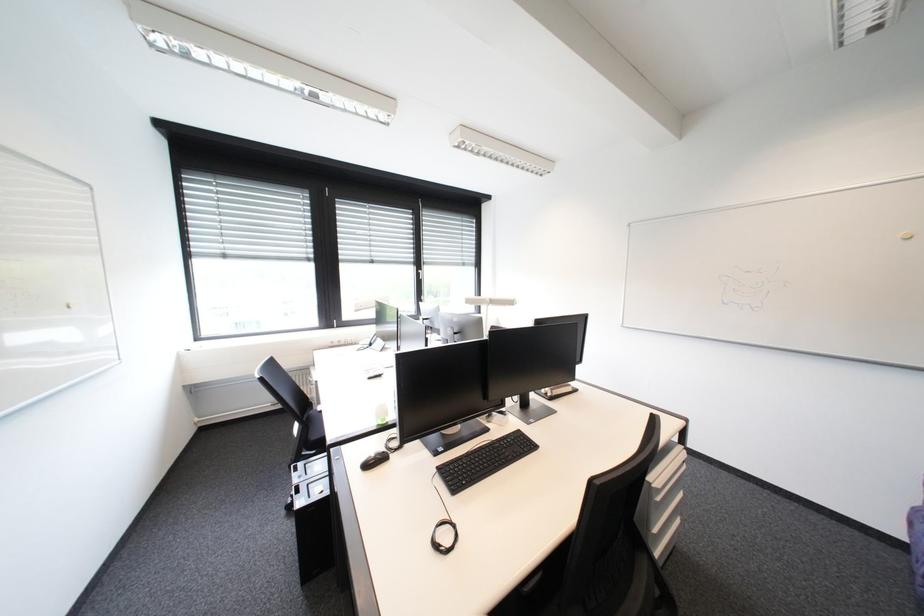
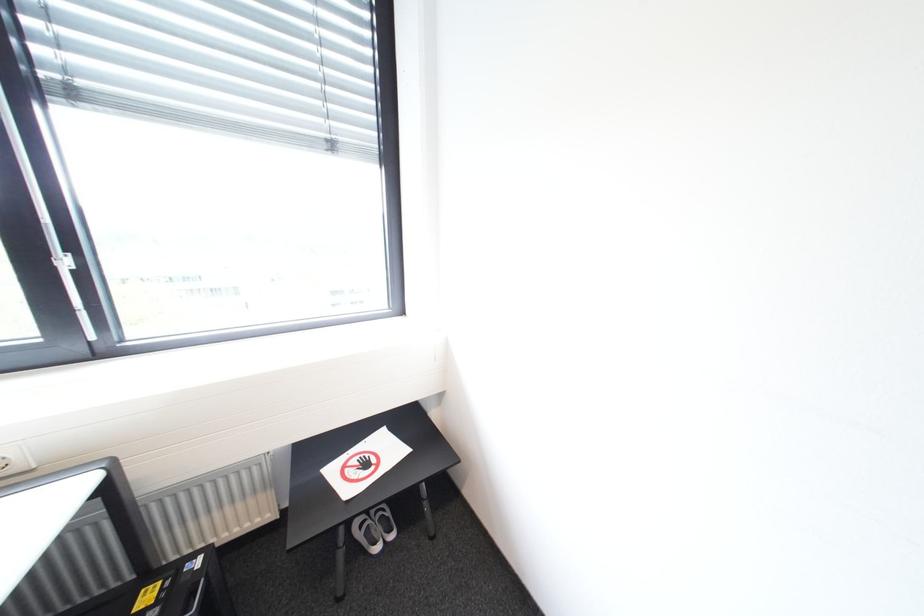
Question: Which direction would the cameraman need to move to produce the second image? Reply with the corresponding letter.

Choices:
 (A) Left
 (B) Right
 (C) Forward
 (D) Backward

Answer: (C)